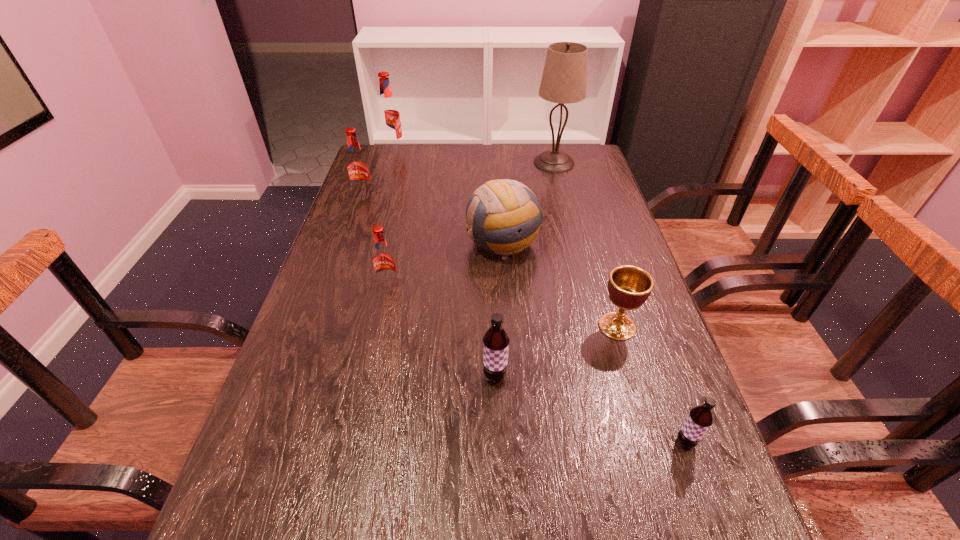
This screenshot has height=540, width=960. Find the location of `free space located on the back of the third object from left to right`. free space located on the back of the third object from left to right is located at coordinates (397, 247).

Locate an element on the screen. vacant area located 0.060m on the left of the second root beer from right to left is located at coordinates (453, 377).

The image size is (960, 540). In order to click on free spot located 0.060m on the front of the third nearest object in this screenshot , I will do `click(629, 364)`.

Image resolution: width=960 pixels, height=540 pixels. What are the coordinates of `vacant space located on the back of the right brown root beer` in the screenshot? It's located at (643, 325).

Locate an element on the screen. This screenshot has width=960, height=540. lampshade that is at the far edge is located at coordinates (564, 80).

Identify the location of root beer located at the far edge. (388, 113).

The width and height of the screenshot is (960, 540). I want to click on lampshade at the right edge, so click(x=564, y=80).

Locate an element on the screen. chalice at the right edge is located at coordinates [x=629, y=286].

Locate an element on the screen. The width and height of the screenshot is (960, 540). root beer that is positioned at the right edge is located at coordinates (700, 418).

Where is `object that is at the far left corner`? The width and height of the screenshot is (960, 540). object that is at the far left corner is located at coordinates (388, 113).